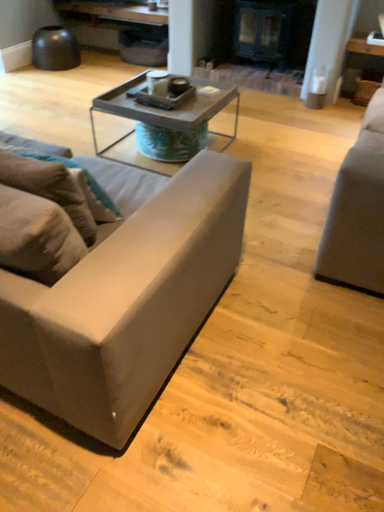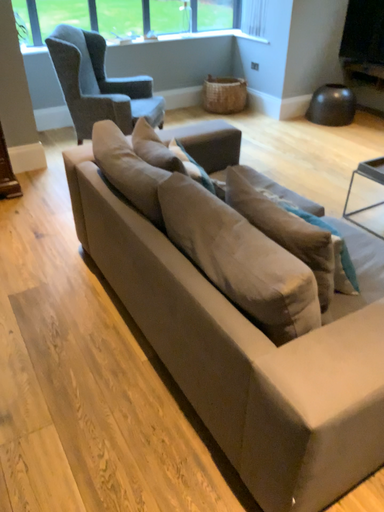
Question: Which way did the camera rotate in the video?

Choices:
 (A) rotated downward
 (B) rotated upward

Answer: (B)